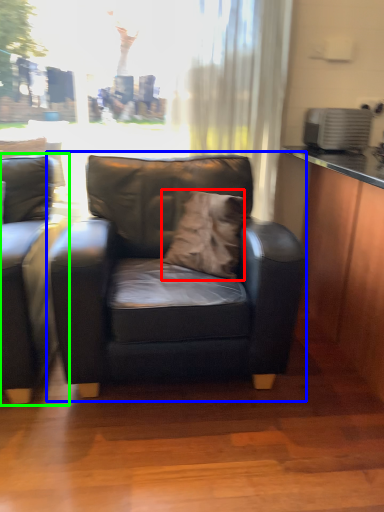
Question: Estimate the real-world distances between objects in this image. Which object is farther from pillow (highlighted by a red box), chair (highlighted by a blue box) or studio couch (highlighted by a green box)?

Choices:
 (A) chair
 (B) studio couch

Answer: (B)